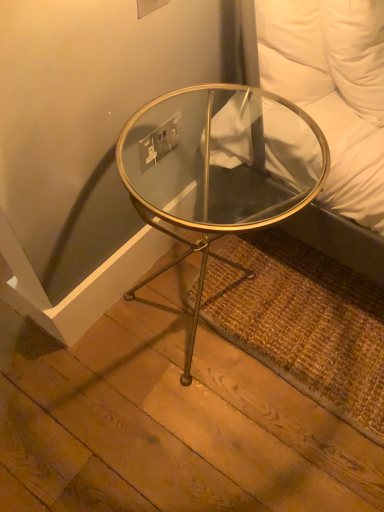
Question: Does clear glass table at center have a greater width compared to white plastic electric outlet at upper center?

Choices:
 (A) no
 (B) yes

Answer: (B)

Question: Is the surface of clear glass table at center in direct contact with white plastic electric outlet at upper center?

Choices:
 (A) no
 (B) yes

Answer: (A)

Question: Does clear glass table at center have a lesser height compared to white plastic electric outlet at upper center?

Choices:
 (A) no
 (B) yes

Answer: (A)

Question: Considering the relative positions of clear glass table at center and white plastic electric outlet at upper center in the image provided, is clear glass table at center behind white plastic electric outlet at upper center?

Choices:
 (A) no
 (B) yes

Answer: (A)

Question: Would you say clear glass table at center is a long distance from white plastic electric outlet at upper center?

Choices:
 (A) no
 (B) yes

Answer: (A)

Question: Is clear glass table at center positioned in front of white plastic electric outlet at upper center?

Choices:
 (A) yes
 (B) no

Answer: (A)

Question: Could you tell me if white plastic electric outlet at upper center is facing clear glass table at center?

Choices:
 (A) yes
 (B) no

Answer: (A)

Question: From a real-world perspective, does white plastic electric outlet at upper center sit lower than clear glass table at center?

Choices:
 (A) no
 (B) yes

Answer: (A)

Question: Considering the relative positions of white plastic electric outlet at upper center and clear glass table at center in the image provided, is white plastic electric outlet at upper center to the left of clear glass table at center from the viewer's perspective?

Choices:
 (A) no
 (B) yes

Answer: (B)

Question: Is white plastic electric outlet at upper center surrounding clear glass table at center?

Choices:
 (A) yes
 (B) no

Answer: (B)

Question: From a real-world perspective, is white plastic electric outlet at upper center over clear glass table at center?

Choices:
 (A) no
 (B) yes

Answer: (B)

Question: Is white plastic electric outlet at upper center far away from clear glass table at center?

Choices:
 (A) yes
 (B) no

Answer: (B)

Question: In the image, is clear glass table at center positioned in front of or behind white plastic electric outlet at upper center?

Choices:
 (A) front
 (B) behind

Answer: (A)